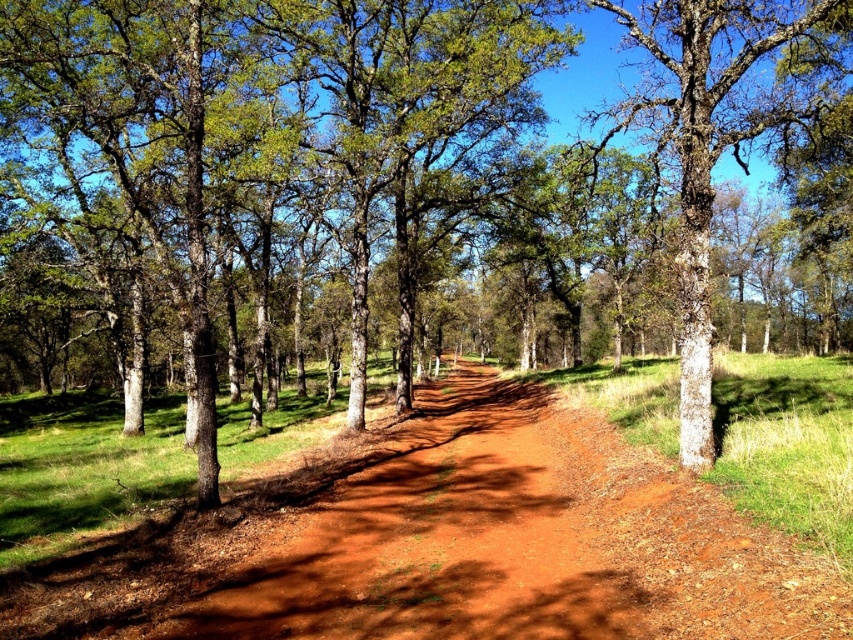
You are a hiker walking along the dusty red dirt track at center. You want to take a photo of the bark textured tree at center. Which direction should you face to capture both the tree and the track in the same frame?

The dusty red dirt track at center is positioned on the left side of the bark textured tree at center. To capture both in the same frame, you should face to the left of the bark textured tree at center so that the track appears on the left side of the tree in the photo.

You are a hiker standing at the starting point of the dirt path in the forest. You see two points marked on the path ahead of you. One is at coordinates point (506,628) and the other is at point (775,36). Which point is closer to you as you walk along the path?

Point (506,628) is in front of point (775,36), so the point closer to you as you walk along the path is point (506,628).